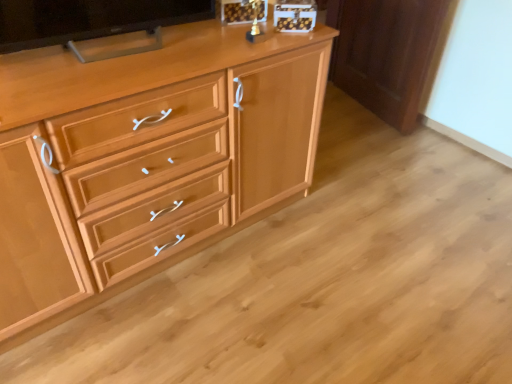
Question: Should I look upward or downward to see light brown wood cabinet at right?

Choices:
 (A) down
 (B) up

Answer: (B)

Question: Can you confirm if matte black tv at upper left is taller than light brown wood cabinet at right?

Choices:
 (A) yes
 (B) no

Answer: (B)

Question: Could you tell me if matte black tv at upper left is turned towards light brown wood cabinet at right?

Choices:
 (A) no
 (B) yes

Answer: (A)

Question: Is matte black tv at upper left smaller than light brown wood cabinet at right?

Choices:
 (A) no
 (B) yes

Answer: (B)

Question: Is light brown wood cabinet at right inside matte black tv at upper left?

Choices:
 (A) yes
 (B) no

Answer: (B)

Question: From a real-world perspective, is matte black tv at upper left under light brown wood cabinet at right?

Choices:
 (A) yes
 (B) no

Answer: (B)

Question: Is matte black tv at upper left thinner than light brown wood cabinet at right?

Choices:
 (A) no
 (B) yes

Answer: (A)

Question: Is light brown wood cabinet at right thinner than light wood cabinet at center?

Choices:
 (A) no
 (B) yes

Answer: (B)

Question: Is light brown wood cabinet at right positioned beyond the bounds of light wood cabinet at center?

Choices:
 (A) yes
 (B) no

Answer: (A)

Question: From the image's perspective, does light brown wood cabinet at right appear lower than light wood cabinet at center?

Choices:
 (A) no
 (B) yes

Answer: (A)

Question: Is light brown wood cabinet at right shorter than light wood cabinet at center?

Choices:
 (A) no
 (B) yes

Answer: (B)

Question: Is light wood cabinet at center completely or partially inside light brown wood cabinet at right?

Choices:
 (A) no
 (B) yes

Answer: (A)

Question: Would you say light brown wood cabinet at right is a long distance from light wood cabinet at center?

Choices:
 (A) no
 (B) yes

Answer: (B)

Question: Is the depth of light wood cabinet at center greater than that of matte black tv at upper left?

Choices:
 (A) no
 (B) yes

Answer: (A)